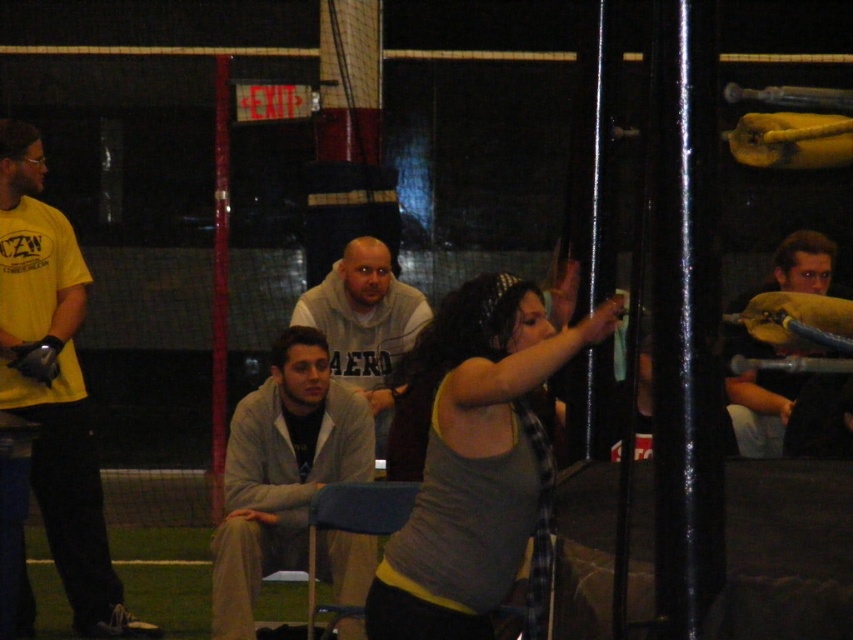
Question: Is gray tank top at center thinner than gray hoodie at center?

Choices:
 (A) no
 (B) yes

Answer: (B)

Question: Among these objects, which one is farthest from the camera?

Choices:
 (A) yellow matte shirt at left
 (B) gray hoodie at center

Answer: (B)

Question: Is gray hoodie at center closer to camera compared to yellow fabric pillow at right?

Choices:
 (A) no
 (B) yes

Answer: (A)

Question: Which object is positioned farthest from the gray hoodie at center?

Choices:
 (A) yellow matte shirt at left
 (B) light gray sweater at center
 (C) yellow fabric pillow at right

Answer: (C)

Question: Which of the following is the farthest from the observer?

Choices:
 (A) light gray sweater at center
 (B) yellow fabric pillow at right
 (C) gray hoodie at center

Answer: (C)

Question: Where is gray hoodie at center located in relation to yellow fabric pillow at right in the image?

Choices:
 (A) left
 (B) right

Answer: (A)